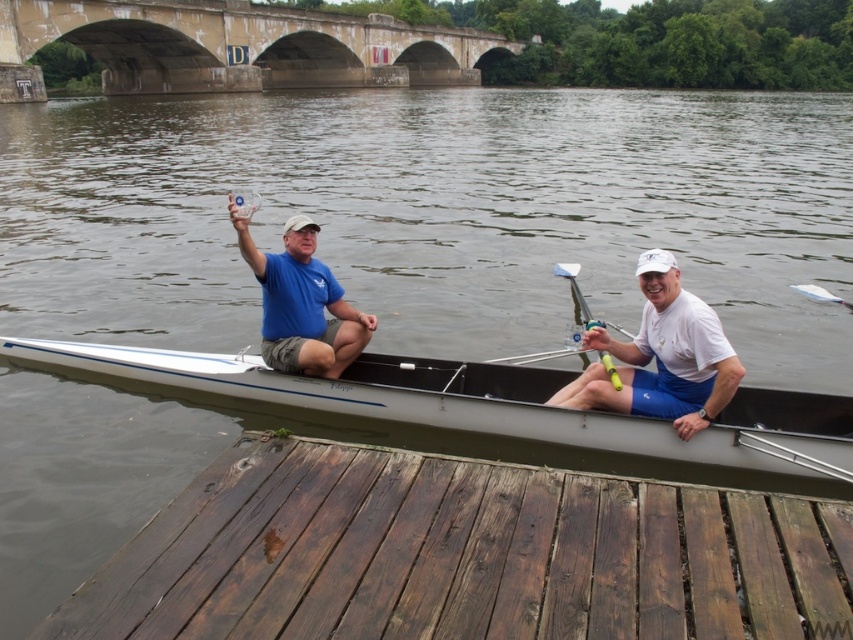
Question: Which object is the closest to the blue cotton shirt at center?

Choices:
 (A) white plastic paddle at right
 (B) weathered wood dock at lower left
 (C) white glossy boat at center
 (D) white matte rowing oar at center

Answer: (C)

Question: Which object is positioned farthest from the white plastic paddle at right?

Choices:
 (A) blue cotton shirt at center
 (B) yellow plastic paddle at center
 (C) concrete stone bridge at upper center
 (D) white glossy boat at center

Answer: (C)

Question: Which of the following is the closest to the observer?

Choices:
 (A) white plastic paddle at right
 (B) white matte rowing oar at center

Answer: (B)

Question: Can you confirm if white matte rowing oar at center is positioned to the left of yellow plastic paddle at center?

Choices:
 (A) yes
 (B) no

Answer: (A)

Question: Does weathered wood dock at lower left have a larger size compared to concrete stone bridge at upper center?

Choices:
 (A) yes
 (B) no

Answer: (B)

Question: Does concrete stone bridge at upper center have a greater width compared to white plastic paddle at right?

Choices:
 (A) yes
 (B) no

Answer: (A)